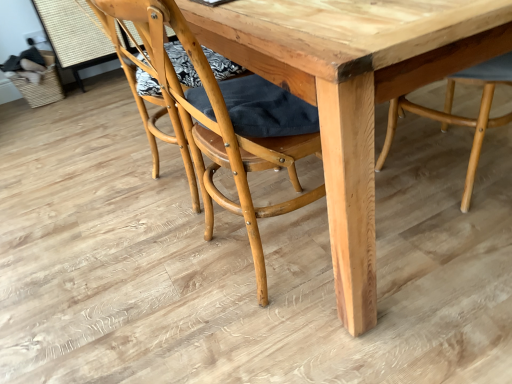
Question: Is natural wood table at center bigger than natural wood chair at center, the first chair when ordered from left to right?

Choices:
 (A) no
 (B) yes

Answer: (B)

Question: Is natural wood table at center located outside natural wood chair at center, positioned as the 2th chair in right-to-left order?

Choices:
 (A) yes
 (B) no

Answer: (A)

Question: From the image's perspective, is natural wood table at center over natural wood chair at center, positioned as the 2th chair in right-to-left order?

Choices:
 (A) yes
 (B) no

Answer: (A)

Question: Can you confirm if natural wood table at center is smaller than natural wood chair at center, positioned as the 2th chair in right-to-left order?

Choices:
 (A) yes
 (B) no

Answer: (B)

Question: From a real-world perspective, is natural wood table at center physically below natural wood chair at center, the first chair when ordered from left to right?

Choices:
 (A) no
 (B) yes

Answer: (B)

Question: Can you confirm if natural wood table at center is taller than natural wood chair at center, the first chair when ordered from left to right?

Choices:
 (A) no
 (B) yes

Answer: (A)

Question: Can you confirm if natural wood chair at center, which is counted as the first chair, starting from the right, is taller than natural wood chair at center, positioned as the 2th chair in right-to-left order?

Choices:
 (A) no
 (B) yes

Answer: (A)

Question: Could you tell me if natural wood chair at center, which is counted as the first chair, starting from the right, is turned towards natural wood chair at center, positioned as the 2th chair in right-to-left order?

Choices:
 (A) no
 (B) yes

Answer: (B)

Question: Can you confirm if natural wood chair at center, which is counted as the first chair, starting from the right, is wider than natural wood chair at center, positioned as the 2th chair in right-to-left order?

Choices:
 (A) yes
 (B) no

Answer: (A)

Question: Is natural wood chair at center, the 2th chair in the left-to-right sequence, next to natural wood chair at center, the first chair when ordered from left to right, and touching it?

Choices:
 (A) yes
 (B) no

Answer: (B)

Question: Can natural wood chair at center, positioned as the 2th chair in right-to-left order, be found inside natural wood chair at center, which is counted as the first chair, starting from the right?

Choices:
 (A) yes
 (B) no

Answer: (B)

Question: Is natural wood chair at center, which is counted as the first chair, starting from the right, closer to camera compared to natural wood chair at center, the first chair when ordered from left to right?

Choices:
 (A) no
 (B) yes

Answer: (A)

Question: From the image's perspective, is natural wood chair at center, the first chair when ordered from left to right, beneath natural wood table at center?

Choices:
 (A) no
 (B) yes

Answer: (B)